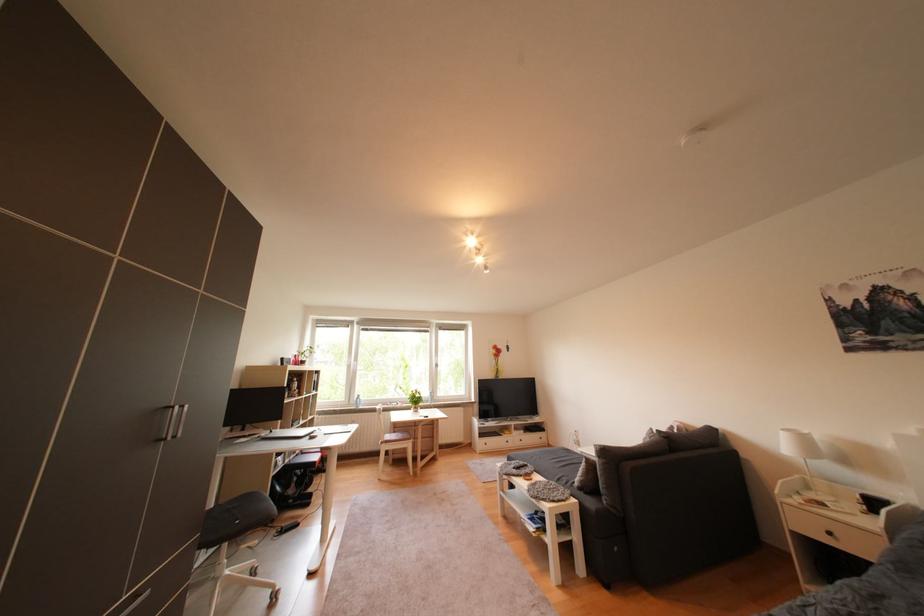
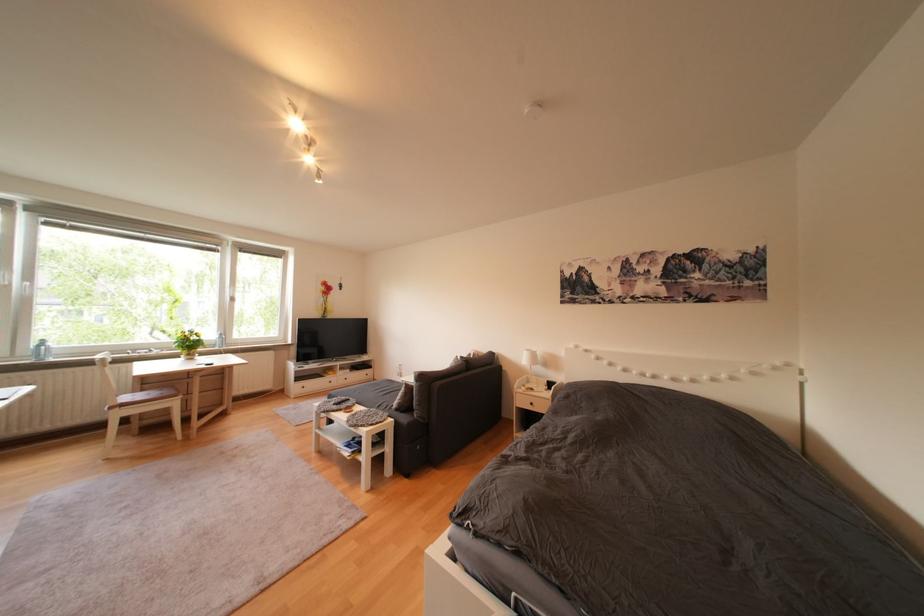
Question: The first image is from the beginning of the video and the second image is from the end. How did the camera likely rotate when shooting the video?

Choices:
 (A) Left
 (B) Right
 (C) Up
 (D) Down

Answer: (B)